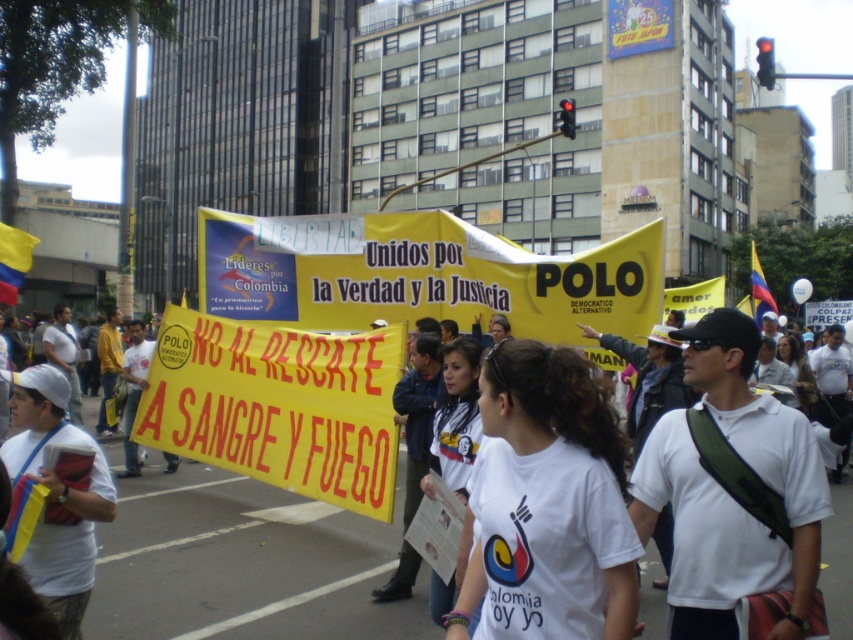
Who is lower down, yellow paper banner at center or white fabric shirt at left?

yellow paper banner at center is below.

Can you confirm if yellow paper banner at center is positioned above white fabric shirt at left?

Incorrect, yellow paper banner at center is not positioned above white fabric shirt at left.

At what (x,y) coordinates should I click in order to perform the action: click on yellow paper banner at center. Please return your answer as a coordinate pair (x, y). The width and height of the screenshot is (853, 640). Looking at the image, I should click on (277, 404).

Find the location of a particular element. The height and width of the screenshot is (640, 853). yellow paper banner at center is located at coordinates (277, 404).